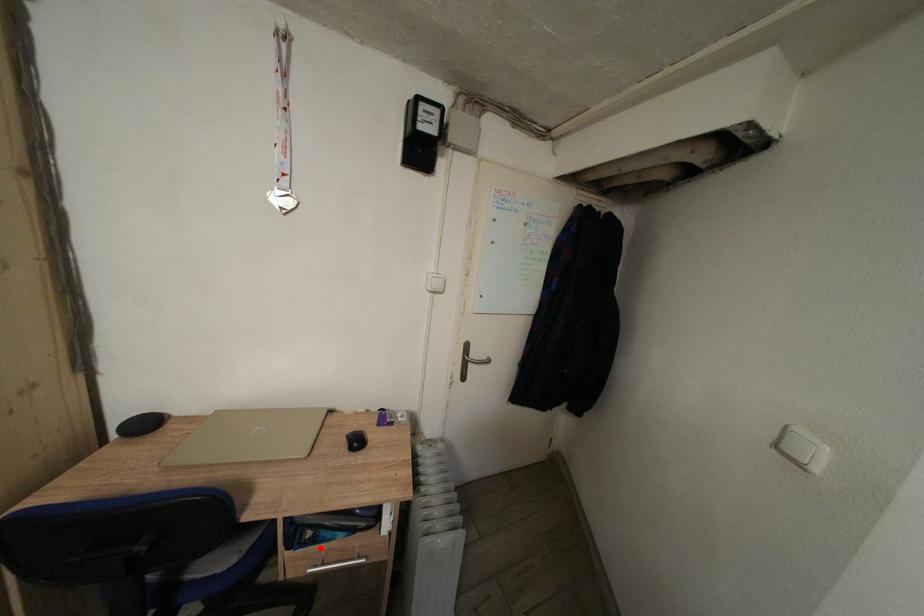
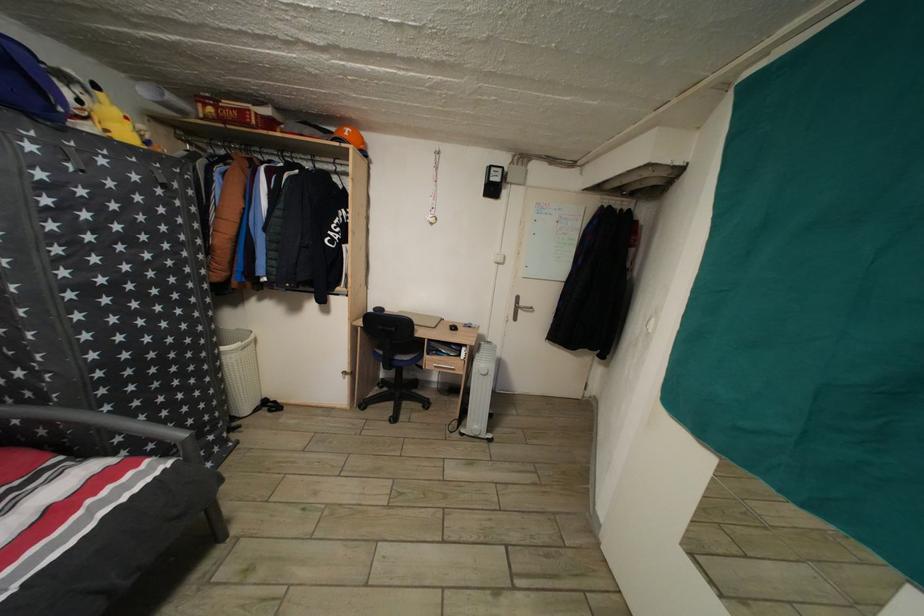
Question: I am providing you with two images of the same scene from different viewpoints. Image1 has a red point marked. In image2, the corresponding 3D location appears at what relative position? Reply with the corresponding letter.

Choices:
 (A) Closer
 (B) Farther

Answer: (B)